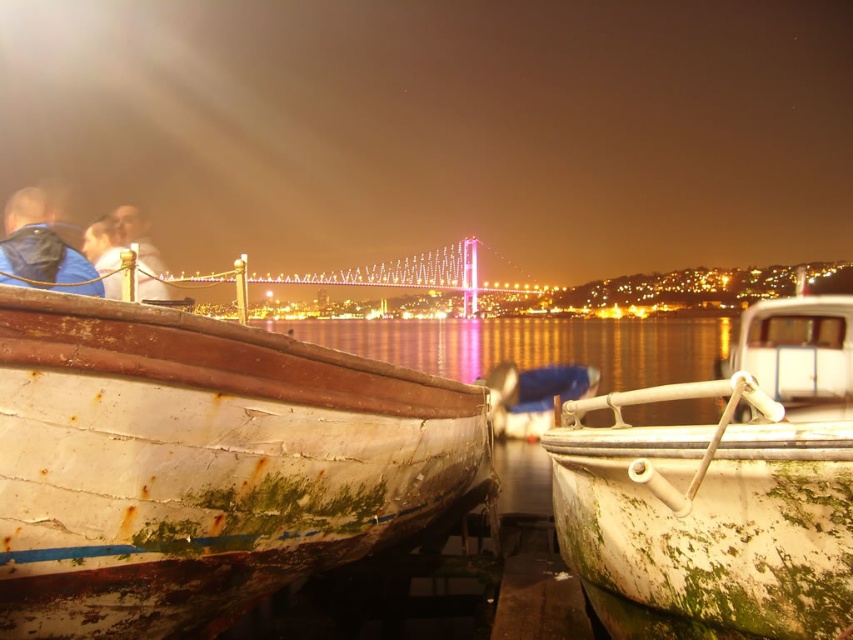
Find the location of a particular element. rusty wood boat at left is located at coordinates (201, 464).

Is rusty wood boat at left positioned before rusty metal water at center?

Yes, rusty wood boat at left is in front of rusty metal water at center.

At what (x,y) coordinates should I click in order to perform the action: click on rusty wood boat at left. Please return your answer as a coordinate pair (x, y). This screenshot has height=640, width=853. Looking at the image, I should click on (201, 464).

Does rusty wood boat at left lie behind green mossy wood boat at right?

That is True.

Between point (294, 392) and point (769, 342), which one is positioned in front?

Positioned in front is point (294, 392).

The height and width of the screenshot is (640, 853). Find the location of `rusty wood boat at left`. rusty wood boat at left is located at coordinates (201, 464).

Does green mossy wood boat at right appear over matte blue jacket at left?

No, green mossy wood boat at right is not above matte blue jacket at left.

Measure the distance between point (740,525) and camera.

They are 7.87 meters apart.

Between point (782, 456) and point (3, 259), which one is positioned in front?

Point (782, 456) is more forward.

This screenshot has width=853, height=640. What are the coordinates of `green mossy wood boat at right` in the screenshot? It's located at (724, 483).